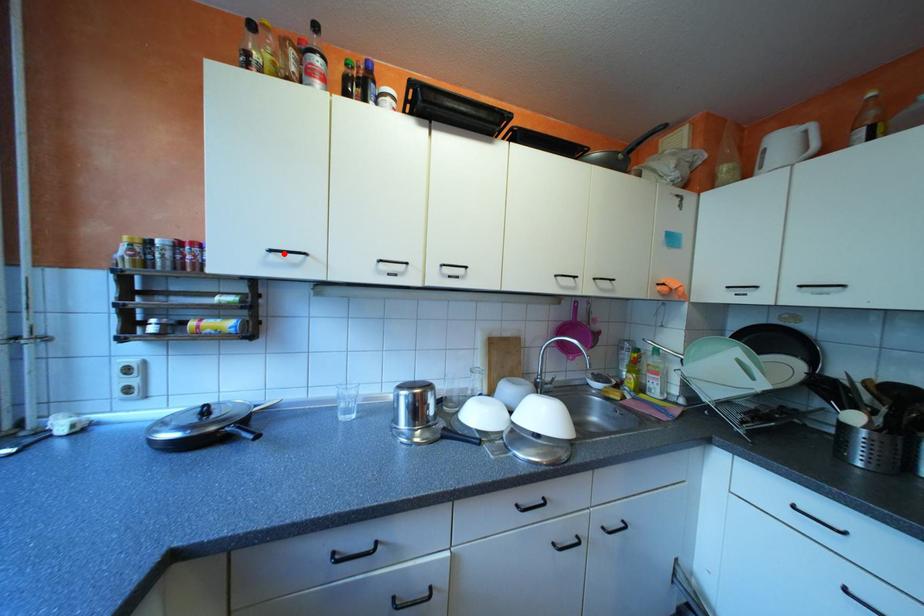
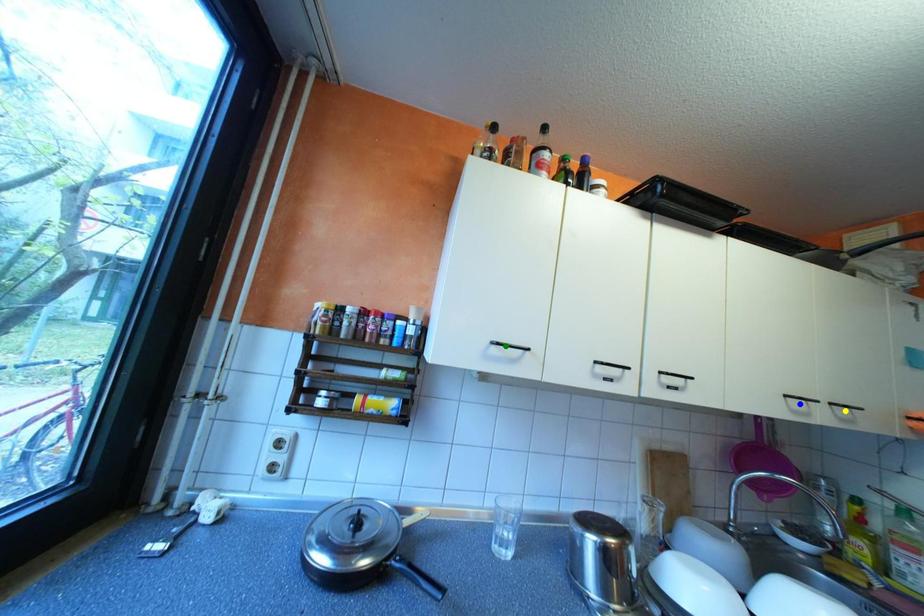
Question: I am providing you with two images of the same scene from different viewpoints. A red point is marked on the first image. You are given multiple points on the second image. In image 2, which mark is for the same physical point as the one in image 1?

Choices:
 (A) yellow point
 (B) blue point
 (C) green point

Answer: (C)